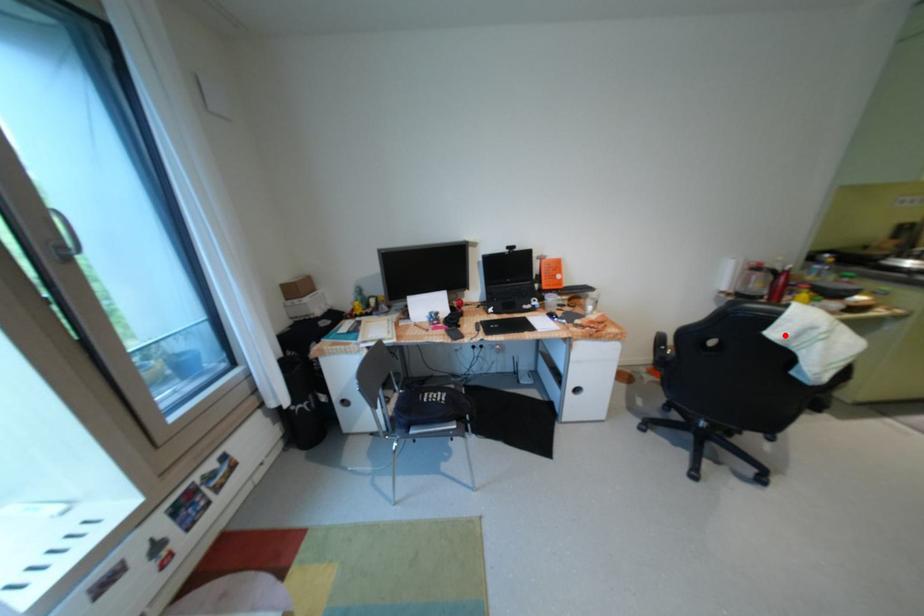
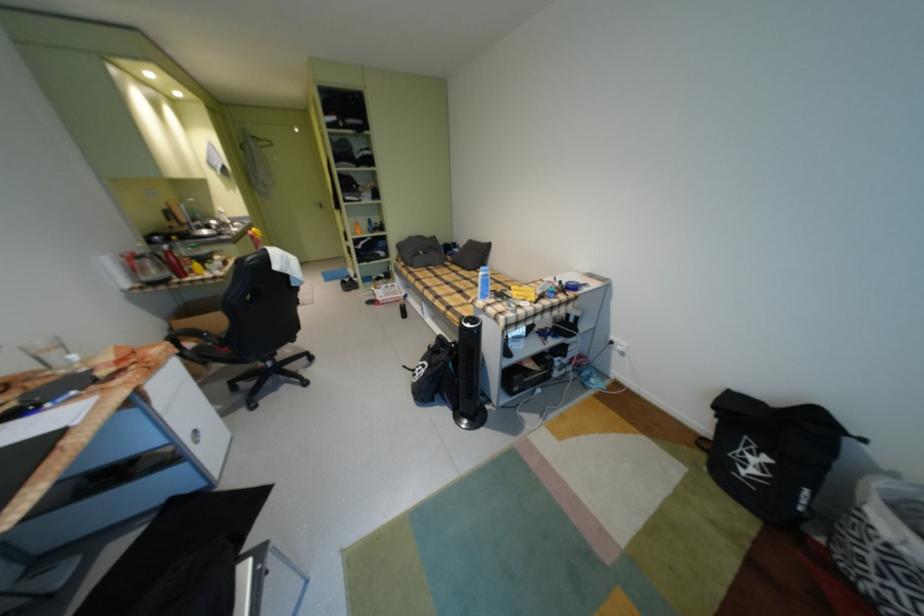
Question: I am providing you with two images of the same scene from different viewpoints. A red point is shown in image1. For the corresponding object point in image2, is it positioned nearer or farther from the camera?

Choices:
 (A) Nearer
 (B) Farther

Answer: (A)